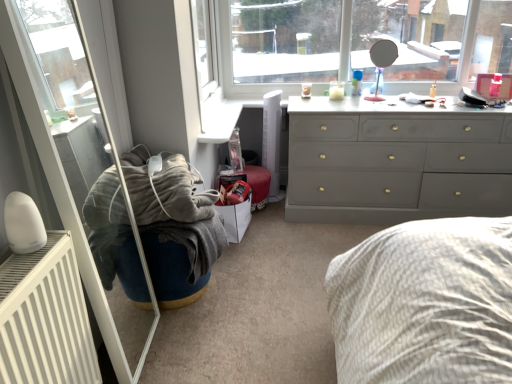
What do you see at coordinates (395, 161) in the screenshot? I see `matte gray dresser at upper right` at bounding box center [395, 161].

In order to face white glossy radiator at left, should I rotate leftwards or rightwards?

Rotate left and turn 20.449 degrees.

Find the location of `white cardboard shoe box at lower center`. white cardboard shoe box at lower center is located at coordinates (236, 218).

Consider the image. Which of these two, dark blue fabric bean bag chair at center or white metallic radiator at lower left, is smaller?

white metallic radiator at lower left is smaller.

The image size is (512, 384). In the image, there is a white metallic radiator at lower left. Identify the location of bean bag chair below it (from a real-world perspective). (174, 226).

Can you confirm if dark blue fabric bean bag chair at center is positioned to the left of white metallic radiator at lower left?

Incorrect, dark blue fabric bean bag chair at center is not on the left side of white metallic radiator at lower left.

Can you tell me how much dark blue fabric bean bag chair at center and white metallic radiator at lower left differ in facing direction?

dark blue fabric bean bag chair at center and white metallic radiator at lower left are facing 3.26 degrees away from each other.

Measure the distance between white glossy radiator at left and dark blue fabric bean bag chair at center.

A distance of 7.07 inches exists between white glossy radiator at left and dark blue fabric bean bag chair at center.

Is white glossy radiator at left aimed at dark blue fabric bean bag chair at center?

Yes.

Which object is closer to the camera, white glossy radiator at left or dark blue fabric bean bag chair at center?

Positioned in front is white glossy radiator at left.

From a real-world perspective, is white metallic radiator at lower left under white cardboard shoe box at lower center?

No, from a real-world perspective, white metallic radiator at lower left is not under white cardboard shoe box at lower center.

Are white metallic radiator at lower left and white cardboard shoe box at lower center located far from each other?

white metallic radiator at lower left is near white cardboard shoe box at lower center, not far away.

Is white metallic radiator at lower left bigger or smaller than white cardboard shoe box at lower center?

white metallic radiator at lower left is bigger than white cardboard shoe box at lower center.

Does white metallic radiator at lower left have a lesser width compared to white cardboard shoe box at lower center?

Correct, the width of white metallic radiator at lower left is less than that of white cardboard shoe box at lower center.

Is dark blue fabric bean bag chair at center at the back of white cardboard shoe box at lower center?

white cardboard shoe box at lower center is not turned away from dark blue fabric bean bag chair at center.

From the image's perspective, is white cardboard shoe box at lower center located above or below dark blue fabric bean bag chair at center?

white cardboard shoe box at lower center is situated higher than dark blue fabric bean bag chair at center in the image.

From their relative heights in the image, would you say white cardboard shoe box at lower center is taller or shorter than dark blue fabric bean bag chair at center?

Considering their sizes, white cardboard shoe box at lower center has more height than dark blue fabric bean bag chair at center.

From a real-world perspective, between white cardboard shoe box at lower center and dark blue fabric bean bag chair at center, who is vertically higher?

From a 3D spatial view, dark blue fabric bean bag chair at center is above.

Who is smaller, matte gray dresser at upper right or dark blue fabric bean bag chair at center?

With smaller size is dark blue fabric bean bag chair at center.

Between point (336, 157) and point (114, 273), which one is positioned in front?

The point (114, 273) is more forward.

Between matte gray dresser at upper right and dark blue fabric bean bag chair at center, which one has more height?

Standing taller between the two is matte gray dresser at upper right.

Does matte gray dresser at upper right lie in front of dark blue fabric bean bag chair at center?

No, it is behind dark blue fabric bean bag chair at center.

Choose the correct answer: Is matte gray dresser at upper right inside white cardboard shoe box at lower center or outside it?

matte gray dresser at upper right cannot be found inside white cardboard shoe box at lower center.

Which is in front, point (471, 169) or point (229, 210)?

The point (229, 210) is more forward.

Can you tell me how much matte gray dresser at upper right and white cardboard shoe box at lower center differ in facing direction?

There is a 90.3-degree angle between the facing directions of matte gray dresser at upper right and white cardboard shoe box at lower center.

Find the location of a particular element. shoe box below the matte gray dresser at upper right (from the image's perspective) is located at coordinates (236, 218).

How many degrees apart are the facing directions of dark blue fabric bean bag chair at center and white glossy radiator at left?

The angular difference between dark blue fabric bean bag chair at center and white glossy radiator at left is 1.91 degrees.

Between dark blue fabric bean bag chair at center and white glossy radiator at left, which one is positioned behind?

Positioned behind is dark blue fabric bean bag chair at center.

Which is in front, point (150, 261) or point (25, 68)?

The point (25, 68) is closer.

From the picture: Which is more to the right, dark blue fabric bean bag chair at center or white glossy radiator at left?

Positioned to the right is dark blue fabric bean bag chair at center.

Locate an element on the screen. This screenshot has height=384, width=512. radiator located in front of the dark blue fabric bean bag chair at center is located at coordinates (45, 318).

This screenshot has height=384, width=512. Find the location of `screen door on the left of dark blue fabric bean bag chair at center`. screen door on the left of dark blue fabric bean bag chair at center is located at coordinates (69, 194).

In the scene shown: Which object lies nearer to the anchor point white cardboard shoe box at lower center, dark blue fabric bean bag chair at center or matte gray dresser at upper right?

dark blue fabric bean bag chair at center is positioned closer to the anchor white cardboard shoe box at lower center.

When comparing their distances from white cardboard shoe box at lower center, does white glossy radiator at left or white metallic radiator at lower left seem further?

Based on the image, white metallic radiator at lower left appears to be further to white cardboard shoe box at lower center.

From the image, which object appears to be farther from white metallic radiator at lower left, white glossy radiator at left or white cardboard shoe box at lower center?

white cardboard shoe box at lower center is positioned further to the anchor white metallic radiator at lower left.

Considering their positions, is white glossy radiator at left positioned closer to matte gray dresser at upper right than white cardboard shoe box at lower center?

Among the two, white cardboard shoe box at lower center is located nearer to matte gray dresser at upper right.

From the image, which object appears to be nearer to white cardboard shoe box at lower center, dark blue fabric bean bag chair at center or white glossy radiator at left?

dark blue fabric bean bag chair at center lies closer to white cardboard shoe box at lower center than the other object.

Considering their positions, is matte gray dresser at upper right positioned further to white cardboard shoe box at lower center than white glossy radiator at left?

→ matte gray dresser at upper right is positioned further to the anchor white cardboard shoe box at lower center.

Looking at the image, which one is located closer to dark blue fabric bean bag chair at center, white glossy radiator at left or matte gray dresser at upper right?

white glossy radiator at left lies closer to dark blue fabric bean bag chair at center than the other object.

From the image, which object appears to be farther from white metallic radiator at lower left, matte gray dresser at upper right or dark blue fabric bean bag chair at center?

matte gray dresser at upper right is further to white metallic radiator at lower left.

Identify the location of bean bag chair positioned between white metallic radiator at lower left and white cardboard shoe box at lower center from near to far. (x=174, y=226).

Locate an element on the screen. This screenshot has width=512, height=384. shoe box between white glossy radiator at left and matte gray dresser at upper right is located at coordinates (x=236, y=218).

What are the coordinates of `bean bag chair between white glossy radiator at left and white cardboard shoe box at lower center along the z-axis` in the screenshot? It's located at (174, 226).

At what (x,y) coordinates should I click in order to perform the action: click on bean bag chair between white metallic radiator at lower left and matte gray dresser at upper right from left to right. Please return your answer as a coordinate pair (x, y). Looking at the image, I should click on (174, 226).